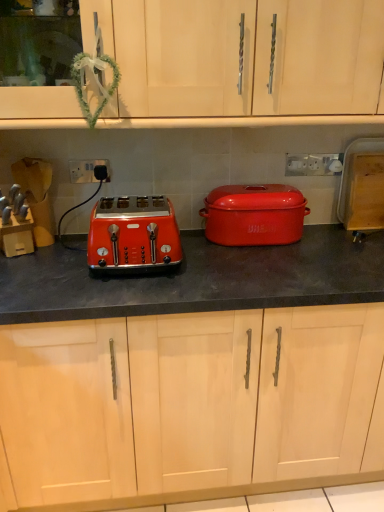
Question: Is white plastic socket at center, placed as the first electric outlet when sorted from front to back, oriented away from matte orange toaster at left?

Choices:
 (A) no
 (B) yes

Answer: (A)

Question: Does white plastic socket at center, which is the first electric outlet in left-to-right order, have a greater width compared to matte orange toaster at left?

Choices:
 (A) no
 (B) yes

Answer: (A)

Question: Can you confirm if white plastic socket at center, placed as the first electric outlet when sorted from front to back, is thinner than matte orange toaster at left?

Choices:
 (A) no
 (B) yes

Answer: (B)

Question: Is white plastic socket at center, which appears as the second electric outlet when viewed from the right, in front of matte orange toaster at left?

Choices:
 (A) yes
 (B) no

Answer: (B)

Question: Does white plastic socket at center, which is the first electric outlet in left-to-right order, appear on the left side of matte orange toaster at left?

Choices:
 (A) no
 (B) yes

Answer: (B)

Question: Considering the relative sizes of white plastic socket at center, placed as the second electric outlet when sorted from back to front, and matte orange toaster at left in the image provided, is white plastic socket at center, placed as the second electric outlet when sorted from back to front, bigger than matte orange toaster at left?

Choices:
 (A) no
 (B) yes

Answer: (A)

Question: Is matte orange toaster at left bigger than matte black toaster at left, which appears as the 2th cabinetry when viewed from the top?

Choices:
 (A) yes
 (B) no

Answer: (B)

Question: Is matte orange toaster at left oriented away from matte black toaster at left, which appears as the 2th cabinetry when viewed from the top?

Choices:
 (A) no
 (B) yes

Answer: (A)

Question: Is matte orange toaster at left positioned behind matte black toaster at left, arranged as the first cabinetry when ordered from the bottom?

Choices:
 (A) yes
 (B) no

Answer: (A)

Question: Is matte orange toaster at left smaller than matte black toaster at left, arranged as the first cabinetry when ordered from the bottom?

Choices:
 (A) no
 (B) yes

Answer: (B)

Question: From the image's perspective, is matte orange toaster at left on top of matte black toaster at left, arranged as the first cabinetry when ordered from the bottom?

Choices:
 (A) no
 (B) yes

Answer: (B)

Question: Considering the relative sizes of matte orange toaster at left and matte black toaster at left, which appears as the 2th cabinetry when viewed from the top, in the image provided, is matte orange toaster at left shorter than matte black toaster at left, which appears as the 2th cabinetry when viewed from the top,?

Choices:
 (A) no
 (B) yes

Answer: (B)

Question: From the image's perspective, would you say matte red casserole at center is shown under matte wood cabinet at upper center, the second cabinetry positioned from the bottom?

Choices:
 (A) no
 (B) yes

Answer: (B)